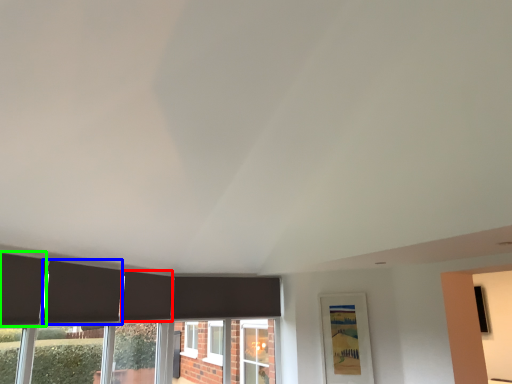
Question: Based on their relative distances, which object is farther from curtain (highlighted by a red box)? Choose from curtain (highlighted by a blue box) and curtain (highlighted by a green box).

Choices:
 (A) curtain
 (B) curtain

Answer: (B)